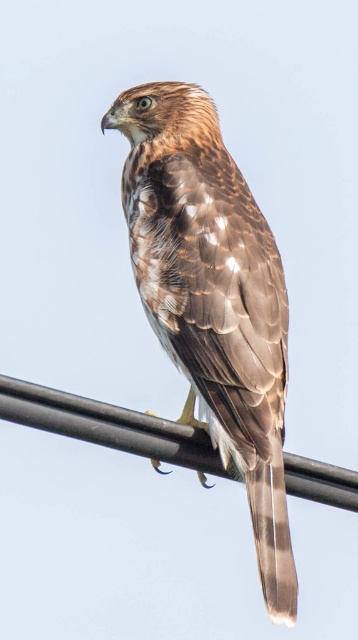
A birdwatcher wants to photograph the brown feathered eagle at center and the black metal power line at center in the same frame. If the camera can capture objects within a 30 inch range, will both fit in the shot?

The brown feathered eagle at center and black metal power line at center are 26.19 inches apart, so yes, both will fit in the camera frame since the distance between them is within the 30 inch range.

You are a birdwatcher observing a scene with a brown feathered eagle at center and a black metal power line at center. Which object is taller in the image?

The brown feathered eagle at center is taller than the black metal power line at center.

You are a birdwatcher observing a brown feathered eagle at center and a black metal power line at center. Which object is positioned higher in the image?

The brown feathered eagle at center is located above the black metal power line at center, so it is positioned higher in the image.